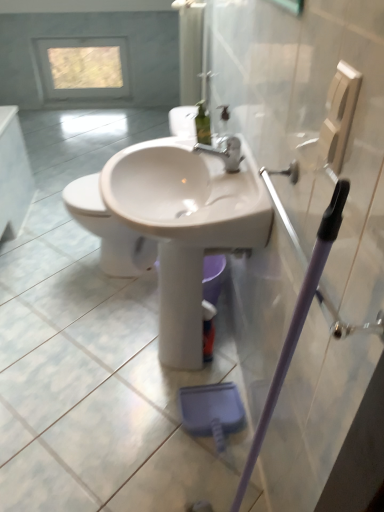
Question: Does white glossy sink at center appear on the right side of white glossy toilet at center?

Choices:
 (A) yes
 (B) no

Answer: (A)

Question: Considering the relative sizes of white glossy sink at center and white glossy toilet at center in the image provided, is white glossy sink at center shorter than white glossy toilet at center?

Choices:
 (A) yes
 (B) no

Answer: (B)

Question: Is white glossy sink at center thinner than white glossy toilet at center?

Choices:
 (A) yes
 (B) no

Answer: (A)

Question: Could you tell me if white glossy sink at center is turned towards white glossy toilet at center?

Choices:
 (A) yes
 (B) no

Answer: (B)

Question: Is white glossy sink at center wider than white glossy toilet at center?

Choices:
 (A) yes
 (B) no

Answer: (B)

Question: Does white glossy sink at center come behind white glossy toilet at center?

Choices:
 (A) no
 (B) yes

Answer: (A)

Question: Does white glossy sink at center appear on the right side of transparent glass window at upper center?

Choices:
 (A) yes
 (B) no

Answer: (A)

Question: Can we say white glossy sink at center lies outside transparent glass window at upper center?

Choices:
 (A) yes
 (B) no

Answer: (A)

Question: Considering the relative sizes of white glossy sink at center and transparent glass window at upper center in the image provided, is white glossy sink at center wider than transparent glass window at upper center?

Choices:
 (A) yes
 (B) no

Answer: (A)

Question: Is white glossy sink at center aimed at transparent glass window at upper center?

Choices:
 (A) no
 (B) yes

Answer: (A)

Question: From a real-world perspective, does white glossy sink at center stand above transparent glass window at upper center?

Choices:
 (A) no
 (B) yes

Answer: (B)

Question: Is white glossy sink at center thinner than transparent glass window at upper center?

Choices:
 (A) yes
 (B) no

Answer: (B)

Question: Would you say white glossy toilet at center is a long distance from transparent glass window at upper center?

Choices:
 (A) yes
 (B) no

Answer: (A)